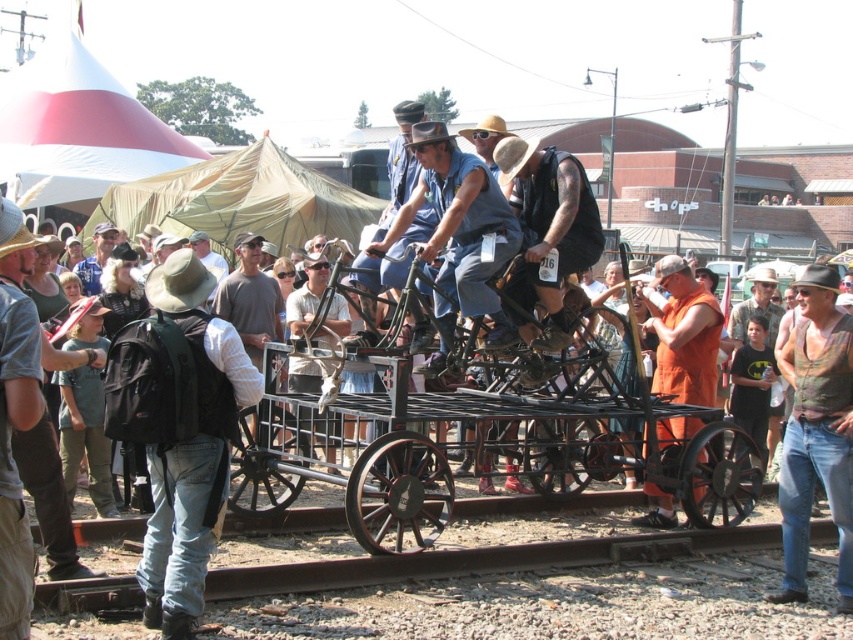
Question: Based on their relative distances, which object is nearer to the metallic silver bicycle at center?

Choices:
 (A) metal at lower left
 (B) orange fabric at center

Answer: (B)

Question: Is black metal wagon at center to the right of metal at lower left from the viewer's perspective?

Choices:
 (A) yes
 (B) no

Answer: (B)

Question: Based on their relative distances, which object is farther from the denim blue shirt at center?

Choices:
 (A) denim jacket at center
 (B) metal at lower left
 (C) brown canvas backpack at left

Answer: (A)

Question: Can you confirm if metal at lower left is wider than white cotton shirt at center?

Choices:
 (A) yes
 (B) no

Answer: (A)

Question: Which point is farther to the camera?

Choices:
 (A) black metal wagon at center
 (B) camouflage tank top at center
 (C) white cotton shirt at center
 (D) brown canvas backpack at left

Answer: (C)

Question: Is black metal wagon at center to the right of denim jacket at center from the viewer's perspective?

Choices:
 (A) no
 (B) yes

Answer: (B)